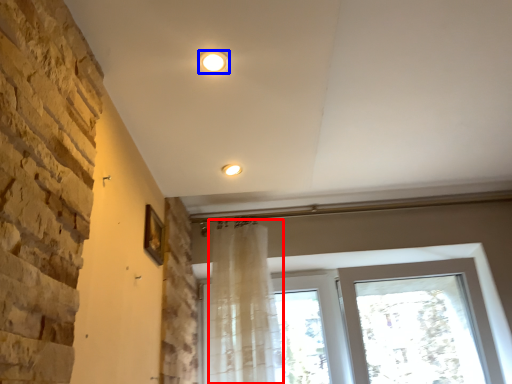
Question: Which point is closer to the camera, shower curtain (highlighted by a red box) or lighting (highlighted by a blue box)?

Choices:
 (A) shower curtain
 (B) lighting

Answer: (B)